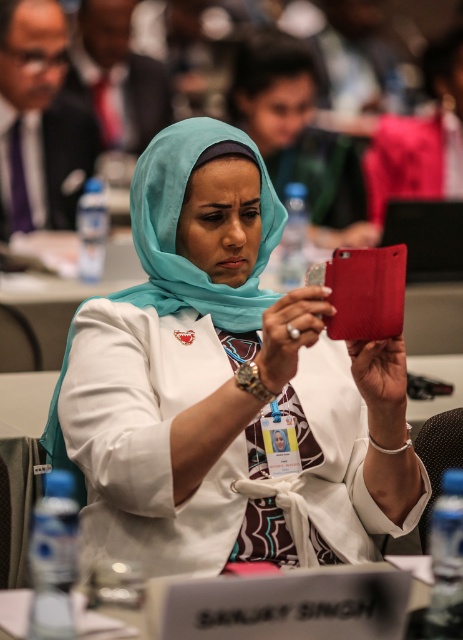
Is matte white shirt at center to the right of matte black water bottle at left from the viewer's perspective?

Indeed, matte white shirt at center is positioned on the right side of matte black water bottle at left.

Is matte white shirt at center shorter than matte black water bottle at left?

Yes.

Where is `matte white shirt at center`? The width and height of the screenshot is (463, 640). matte white shirt at center is located at coordinates (225, 387).

This screenshot has width=463, height=640. Find the location of `matte white shirt at center`. matte white shirt at center is located at coordinates (225, 387).